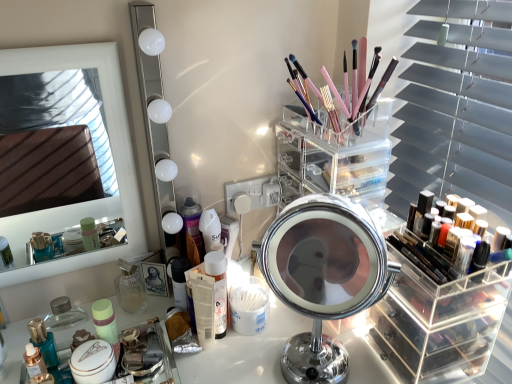
Where is `vacant position to the left of chrome/metallic mirror at center, marked as the third mirror in a left-to-right arrangement`? The width and height of the screenshot is (512, 384). vacant position to the left of chrome/metallic mirror at center, marked as the third mirror in a left-to-right arrangement is located at coordinates (231, 354).